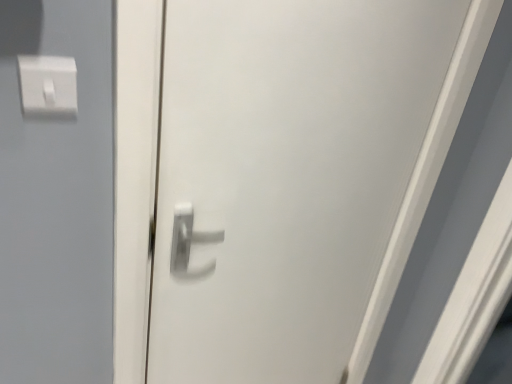
The image size is (512, 384). What do you see at coordinates (285, 178) in the screenshot? I see `white glossy door handle at center` at bounding box center [285, 178].

The image size is (512, 384). What are the coordinates of `white glossy door handle at center` in the screenshot? It's located at (285, 178).

Measure the distance between point (67, 112) and camera.

Point (67, 112) is 29.57 inches away from camera.

Image resolution: width=512 pixels, height=384 pixels. Identify the location of white plastic light switch at upper left. tap(48, 86).

Describe the element at coordinates (48, 86) in the screenshot. I see `white plastic light switch at upper left` at that location.

Image resolution: width=512 pixels, height=384 pixels. Identify the location of white glossy door handle at center. (285, 178).

Considering the relative positions of white plastic light switch at upper left and white glossy door handle at center in the image provided, is white plastic light switch at upper left to the left or to the right of white glossy door handle at center?

Based on their positions, white plastic light switch at upper left is located to the left of white glossy door handle at center.

Considering their positions, is white plastic light switch at upper left located in front of or behind white glossy door handle at center?

white plastic light switch at upper left is behind white glossy door handle at center.

Is point (45, 114) closer or farther from the camera than point (324, 296)?

Point (45, 114) is positioned closer to the camera compared to point (324, 296).

From the image's perspective, does white plastic light switch at upper left appear lower than white glossy door handle at center?

Actually, white plastic light switch at upper left appears above white glossy door handle at center in the image.

From a real-world perspective, relative to white glossy door handle at center, is white plastic light switch at upper left vertically above or below?

Clearly, from a real-world perspective, white plastic light switch at upper left is above white glossy door handle at center.

Can you confirm if white plastic light switch at upper left is wider than white glossy door handle at center?

No, white plastic light switch at upper left is not wider than white glossy door handle at center.

From their relative heights in the image, would you say white plastic light switch at upper left is taller or shorter than white glossy door handle at center?

white plastic light switch at upper left is shorter than white glossy door handle at center.

Which of these two, white plastic light switch at upper left or white glossy door handle at center, is smaller?

white plastic light switch at upper left.

Would you say white plastic light switch at upper left is outside white glossy door handle at center?

Yes.

Is white plastic light switch at upper left not near white glossy door handle at center?

white plastic light switch at upper left is actually quite close to white glossy door handle at center.

Is white glossy door handle at center at the back of white plastic light switch at upper left?

No, white plastic light switch at upper left is not facing the opposite direction of white glossy door handle at center.

Based on the photo, how different are the orientations of white plastic light switch at upper left and white glossy door handle at center in degrees?

The angular difference between white plastic light switch at upper left and white glossy door handle at center is 3.38 degrees.

I want to click on door lying on the right of white plastic light switch at upper left, so click(285, 178).

Does white glossy door handle at center appear on the left side of white plastic light switch at upper left?

No.

Is white glossy door handle at center positioned behind white plastic light switch at upper left?

No, white glossy door handle at center is closer to the camera.

Which point is more distant from viewer, (x=310, y=241) or (x=60, y=68)?

The point (x=310, y=241) is farther.

From the image's perspective, does white glossy door handle at center appear lower than white plastic light switch at upper left?

Yes, from the image's perspective, white glossy door handle at center is beneath white plastic light switch at upper left.

From a real-world perspective, is white glossy door handle at center positioned above or below white plastic light switch at upper left?

white glossy door handle at center is situated lower than white plastic light switch at upper left in the real world.

Between white glossy door handle at center and white plastic light switch at upper left, which one has larger width?

With larger width is white glossy door handle at center.

Can you confirm if white glossy door handle at center is taller than white plastic light switch at upper left?

Yes.

Between white glossy door handle at center and white plastic light switch at upper left, which one has larger size?

white glossy door handle at center.

Which is correct: white glossy door handle at center is inside white plastic light switch at upper left, or outside of it?

white glossy door handle at center is spatially situated outside white plastic light switch at upper left.

Is white glossy door handle at center not close to white plastic light switch at upper left?

No, there isn't a large distance between white glossy door handle at center and white plastic light switch at upper left.

Is white glossy door handle at center facing towards white plastic light switch at upper left?

No.

What's the angular difference between white glossy door handle at center and white plastic light switch at upper left's facing directions?

They differ by 3.38 degrees in their facing directions.

How far apart are white glossy door handle at center and white plastic light switch at upper left?

The distance of white glossy door handle at center from white plastic light switch at upper left is 22.72 inches.

What are the coordinates of `door in front of the white plastic light switch at upper left` in the screenshot? It's located at (285, 178).

Find the location of a particular element. This screenshot has height=384, width=512. door located on the right of white plastic light switch at upper left is located at coordinates [x=285, y=178].

I want to click on door in front of the white plastic light switch at upper left, so click(x=285, y=178).